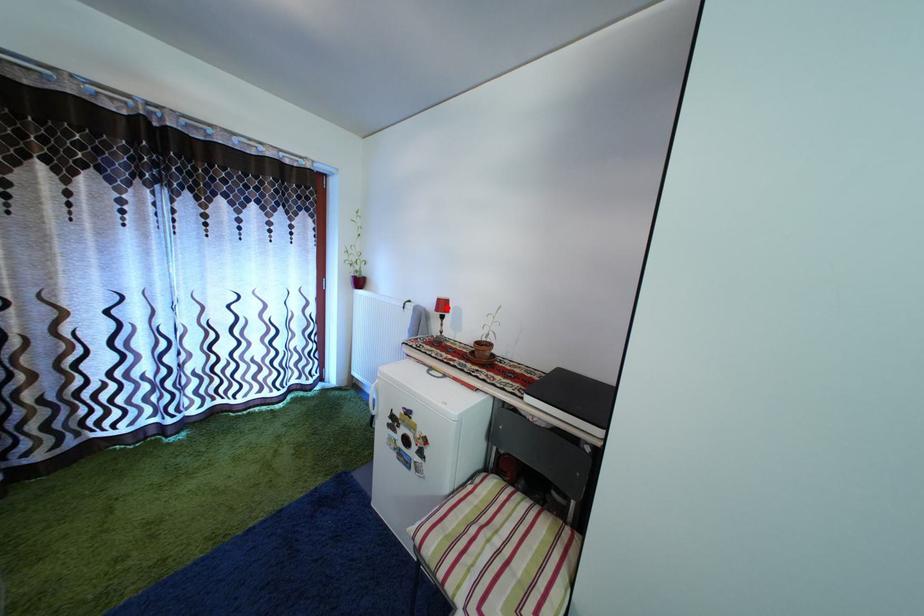
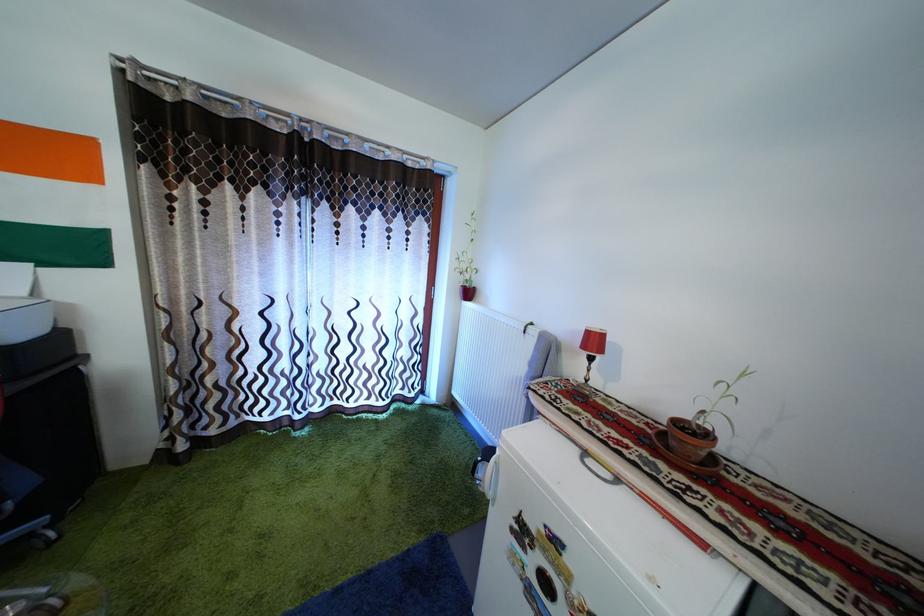
Question: I am providing you with two images of the same scene from different viewpoints. A red point is marked on the first image. Can you still see the location of the red point in image 2?

Choices:
 (A) Yes
 (B) No

Answer: (A)